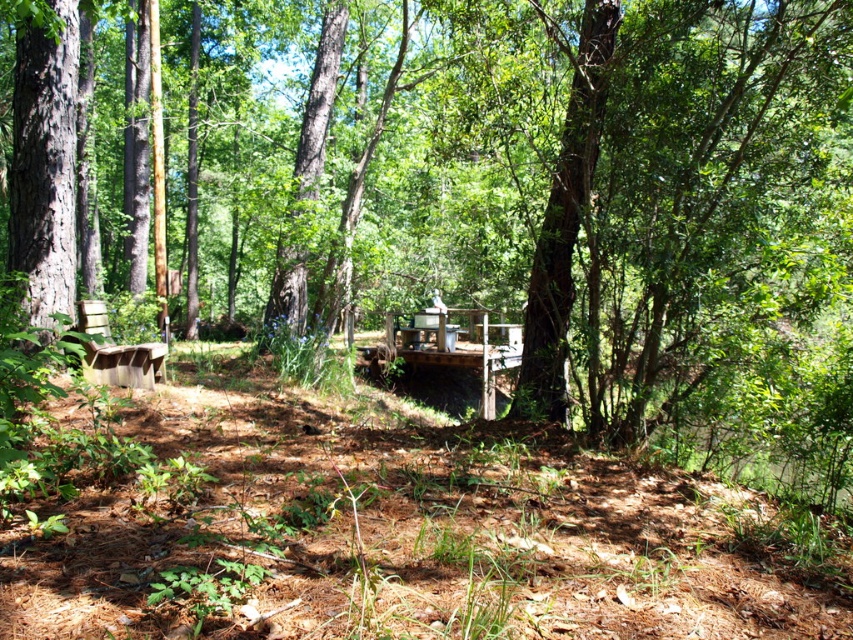
Describe the element at coordinates (460, 346) in the screenshot. The width and height of the screenshot is (853, 640). I see `wooden picnic table at center` at that location.

Between wooden picnic table at center and wooden park bench at left, which one appears on the right side from the viewer's perspective?

From the viewer's perspective, wooden picnic table at center appears more on the right side.

Is point (491, 388) positioned before point (132, 358)?

No.

The height and width of the screenshot is (640, 853). What are the coordinates of `wooden picnic table at center` in the screenshot? It's located at (460, 346).